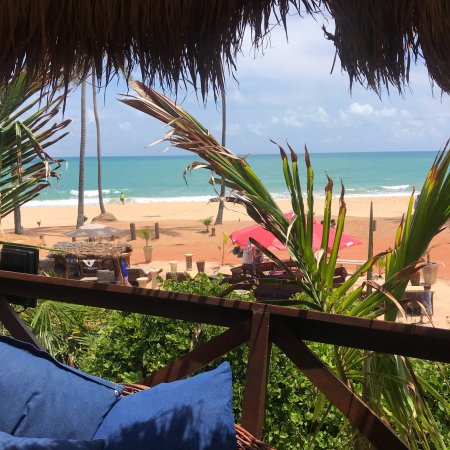
Where is `pillow`? Image resolution: width=450 pixels, height=450 pixels. pillow is located at coordinates point(172,426).